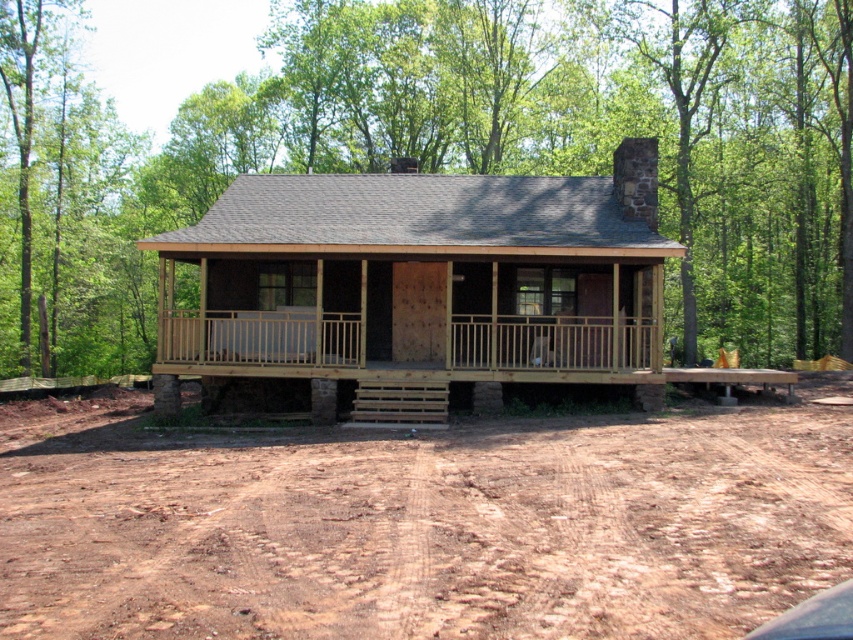
Question: Can you confirm if green leafy tree at center is smaller than brown dirt field at lower center?

Choices:
 (A) yes
 (B) no

Answer: (B)

Question: Can you confirm if wooden cabin at center is bigger than natural wood porch at center?

Choices:
 (A) yes
 (B) no

Answer: (A)

Question: Which point is closer to the camera?

Choices:
 (A) natural wood porch at center
 (B) green leafy tree at center
 (C) brown dirt field at lower center
 (D) wooden cabin at center

Answer: (C)

Question: Which object is farther from the camera taking this photo?

Choices:
 (A) natural wood porch at center
 (B) brown dirt field at lower center
 (C) green leafy tree at center

Answer: (A)

Question: Does green leafy tree at center appear on the right side of wooden cabin at center?

Choices:
 (A) yes
 (B) no

Answer: (B)

Question: Estimate the real-world distances between objects in this image. Which object is farther from the natural wood porch at center?

Choices:
 (A) green leafy tree at center
 (B) wooden cabin at center

Answer: (A)